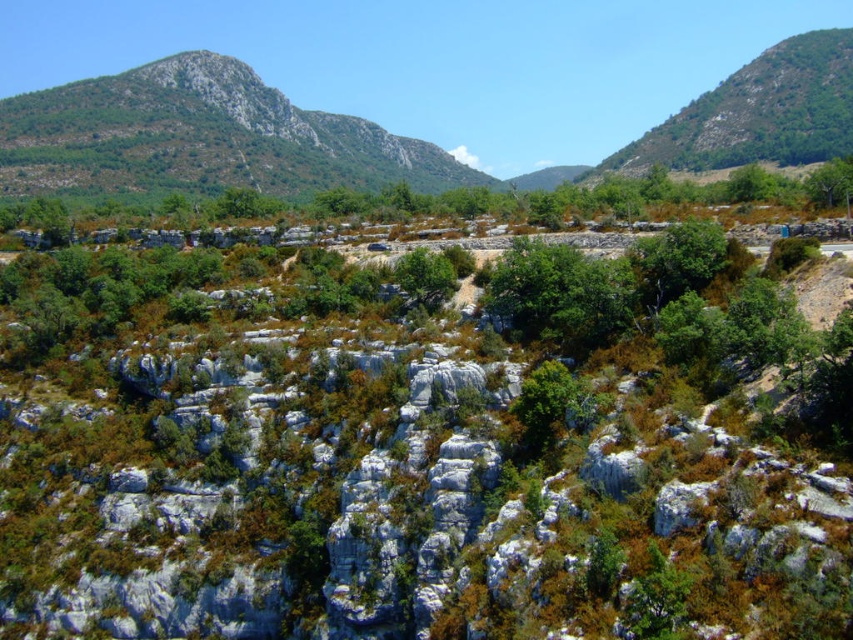
You are planning a hiking route and need to decide whether to go around the rugged stone mountain at upper left or pass through the area near the green leafy tree at center. Based on their sizes, which path would require more effort due to the terrain?

The rugged stone mountain at upper left is larger than the green leafy tree at center, so the path around the rugged stone mountain at upper left would likely require more effort due to its size and rugged terrain.

You are a hiker trying to navigate through the mountainous landscape. You see the green leafy hillside at upper right and the green leafy tree at center. Which object is closer to you based on their positions?

The green leafy tree at center is behind the green leafy hillside at upper right, so the hillside is closer to you.

You are a hiker standing at the base of the rugged stone mountain at upper left and want to reach the green leafy tree at center. Which direction should you head to move closer to the tree?

The rugged stone mountain at upper left is to the left of the green leafy tree at center, so you should head to the right to move closer to the tree.